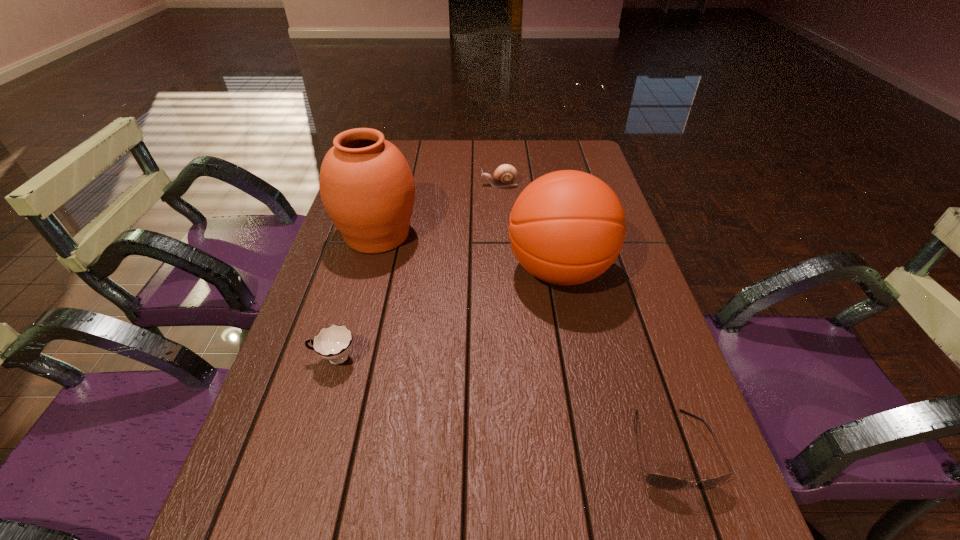
The width and height of the screenshot is (960, 540). Find the location of `vacant area that lies between the fourth farthest object and the escargot`. vacant area that lies between the fourth farthest object and the escargot is located at coordinates (417, 272).

The width and height of the screenshot is (960, 540). In order to click on empty location between the urn and the basketball in this screenshot , I will do `click(468, 253)`.

I want to click on vacant area that lies between the escargot and the urn, so click(439, 210).

The height and width of the screenshot is (540, 960). Find the location of `free spot between the escargot and the cup`. free spot between the escargot and the cup is located at coordinates (417, 272).

Image resolution: width=960 pixels, height=540 pixels. Find the location of `free space between the urn and the sunglasses`. free space between the urn and the sunglasses is located at coordinates (524, 342).

Find the location of a particular element. vacant space that is in between the escargot and the urn is located at coordinates (439, 210).

The height and width of the screenshot is (540, 960). I want to click on free spot between the second nearest object and the sunglasses, so click(502, 404).

This screenshot has width=960, height=540. I want to click on empty space between the sunglasses and the urn, so pos(524,342).

Locate an element on the screen. unoccupied area between the cup and the urn is located at coordinates (356, 297).

Where is `object that is the fourth nearest to the escargot`? Image resolution: width=960 pixels, height=540 pixels. object that is the fourth nearest to the escargot is located at coordinates (663, 482).